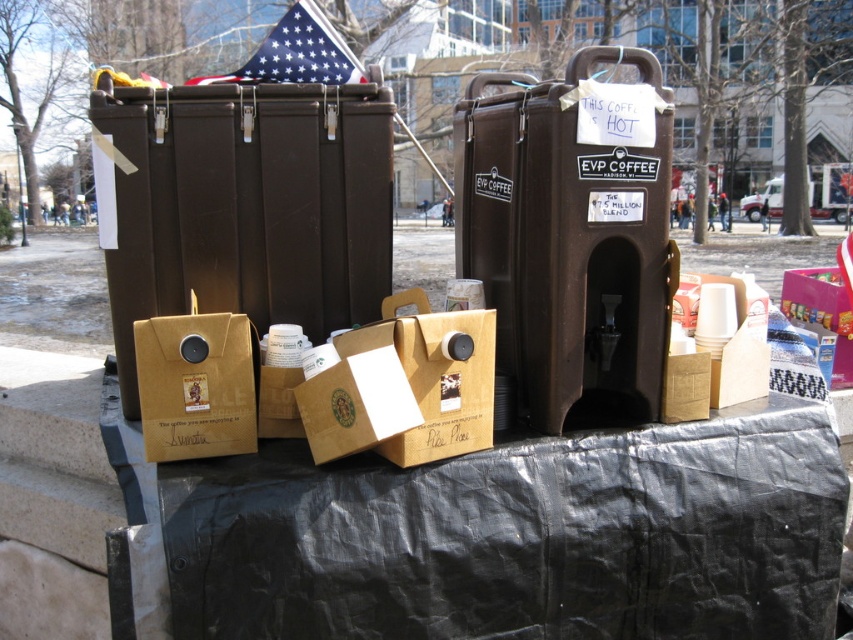
Between point (393, 412) and point (144, 432), which one is positioned in front?

Point (393, 412)

Looking at this image, is matte brown cardboard box at center positioned at the back of brown paper bag at center?

No, matte brown cardboard box at center is in front of brown paper bag at center.

The width and height of the screenshot is (853, 640). What do you see at coordinates (404, 387) in the screenshot?
I see `matte brown cardboard box at center` at bounding box center [404, 387].

At what (x,y) coordinates should I click in order to perform the action: click on matte brown cardboard box at center. Please return your answer as a coordinate pair (x, y). Looking at the image, I should click on (404, 387).